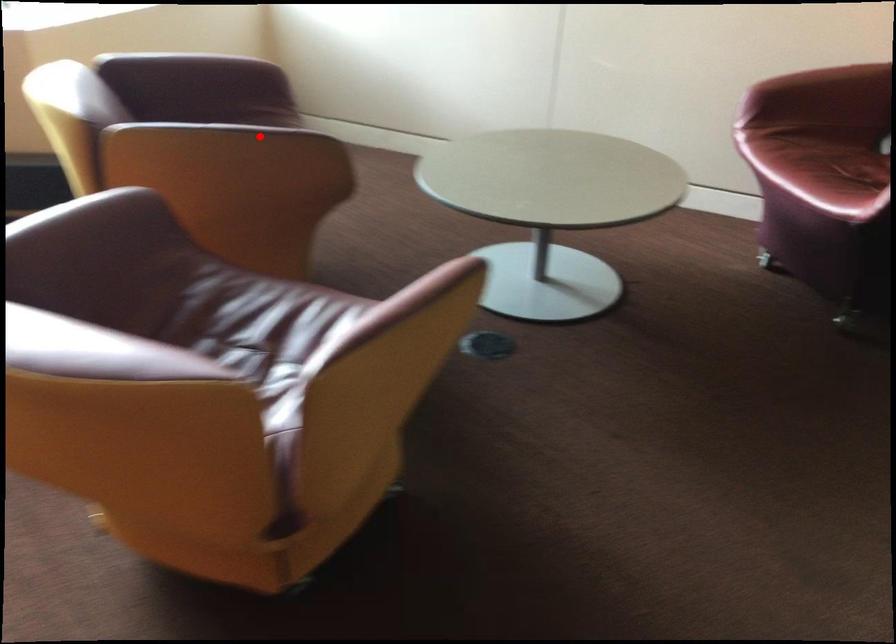
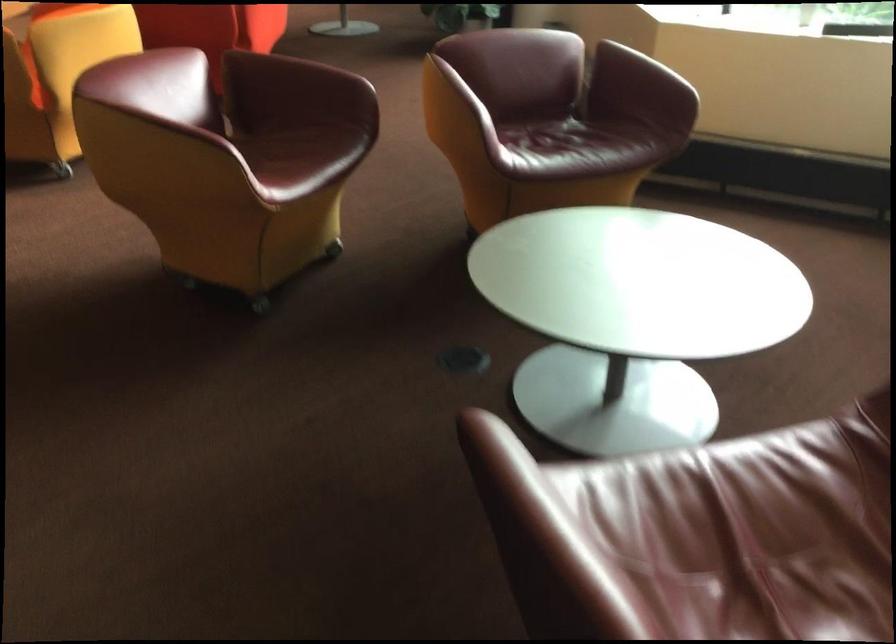
Question: I am providing you with two images of the same scene from different viewpoints. In image1, a red point is highlighted. Considering the same 3D point in image2, which of the following is correct?

Choices:
 (A) It is closer
 (B) It is farther

Answer: (B)